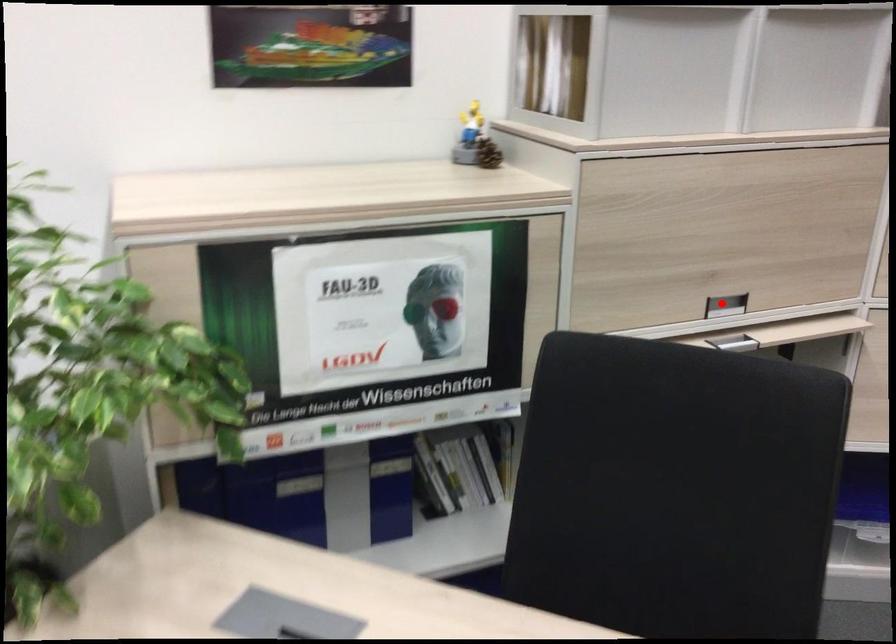
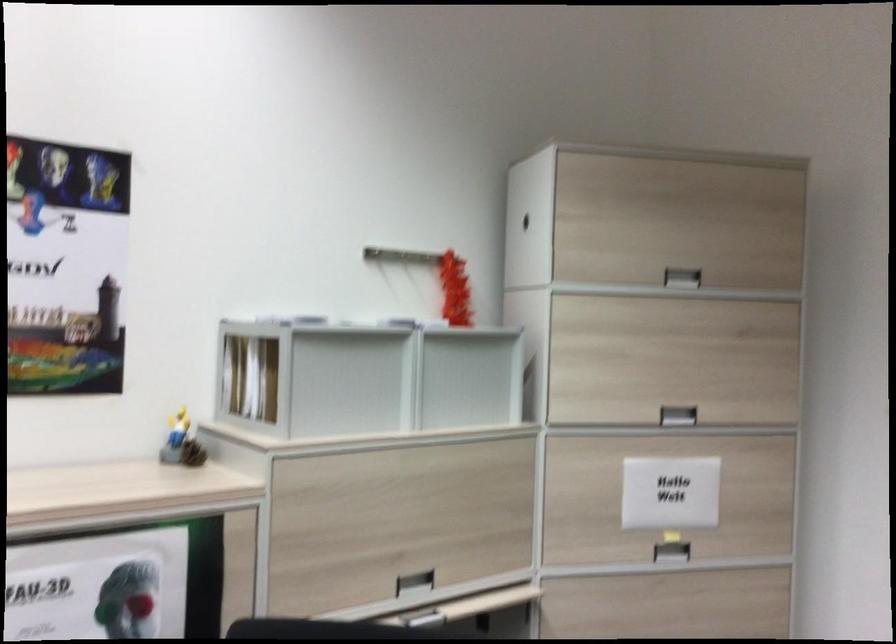
In the second image, find the point that corresponds to the highlighted location in the first image.

(415, 583)